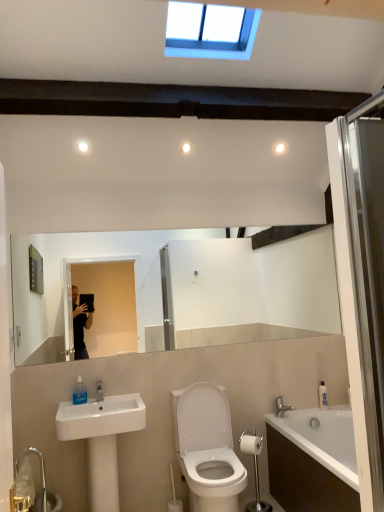
Question: Does transparent glass shower door at right turn towards white glossy sink at lower left?

Choices:
 (A) yes
 (B) no

Answer: (B)

Question: Can you confirm if transparent glass shower door at right is bigger than white glossy sink at lower left?

Choices:
 (A) yes
 (B) no

Answer: (B)

Question: Can you confirm if transparent glass shower door at right is positioned to the left of white glossy sink at lower left?

Choices:
 (A) no
 (B) yes

Answer: (A)

Question: Could white glossy sink at lower left be considered to be inside transparent glass shower door at right?

Choices:
 (A) yes
 (B) no

Answer: (B)

Question: Is transparent glass shower door at right further to the viewer compared to white glossy sink at lower left?

Choices:
 (A) no
 (B) yes

Answer: (A)

Question: From a real-world perspective, is transparent plastic soap dispenser at lower left, positioned as the second toiletry in back-to-front order, above or below silver metallic faucet at lower right?

Choices:
 (A) above
 (B) below

Answer: (A)

Question: Is transparent plastic soap dispenser at lower left, which is counted as the 1th toiletry, starting from the top, in front of or behind silver metallic faucet at lower right in the image?

Choices:
 (A) front
 (B) behind

Answer: (A)

Question: Is transparent plastic soap dispenser at lower left, acting as the first toiletry starting from the left, inside the boundaries of silver metallic faucet at lower right, or outside?

Choices:
 (A) inside
 (B) outside

Answer: (B)

Question: In terms of size, does transparent plastic soap dispenser at lower left, which ranks as the first toiletry in front-to-back order, appear bigger or smaller than silver metallic faucet at lower right?

Choices:
 (A) small
 (B) big

Answer: (A)

Question: From the image's perspective, is white plastic soap dispenser at lower right, marked as the second toiletry in a front-to-back arrangement, positioned above or below transparent plastic soap dispenser at lower left, positioned as the second toiletry in back-to-front order?

Choices:
 (A) above
 (B) below

Answer: (B)

Question: Considering their positions, is white plastic soap dispenser at lower right, which appears as the 2th toiletry when viewed from the top, located in front of or behind transparent plastic soap dispenser at lower left, positioned as the second toiletry in back-to-front order?

Choices:
 (A) front
 (B) behind

Answer: (B)

Question: From a real-world perspective, is white plastic soap dispenser at lower right, the second toiletry when ordered from left to right, positioned above or below transparent plastic soap dispenser at lower left, the 2th toiletry positioned from the bottom?

Choices:
 (A) above
 (B) below

Answer: (B)

Question: Considering the positions of white plastic soap dispenser at lower right, the second toiletry when ordered from left to right, and transparent plastic soap dispenser at lower left, which is counted as the 1th toiletry, starting from the top, in the image, is white plastic soap dispenser at lower right, the second toiletry when ordered from left to right, taller or shorter than transparent plastic soap dispenser at lower left, which is counted as the 1th toiletry, starting from the top,?

Choices:
 (A) short
 (B) tall

Answer: (B)

Question: Looking at the image, does white matte toilet paper at lower right seem bigger or smaller compared to transparent glass shower door at right?

Choices:
 (A) small
 (B) big

Answer: (A)

Question: Relative to transparent glass shower door at right, is white matte toilet paper at lower right in front or behind?

Choices:
 (A) behind
 (B) front

Answer: (A)